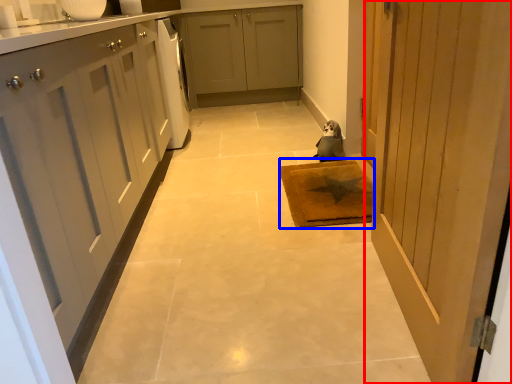
Question: Which of the following is the farthest to the observer, door (highlighted by a red box) or mat (highlighted by a blue box)?

Choices:
 (A) door
 (B) mat

Answer: (B)